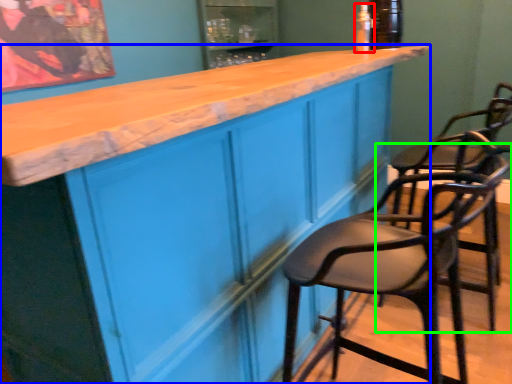
Question: Based on their relative distances, which object is nearer to bottle (highlighted by a red box)? Choose from cabinetry (highlighted by a blue box) and chair (highlighted by a green box).

Choices:
 (A) cabinetry
 (B) chair

Answer: (A)